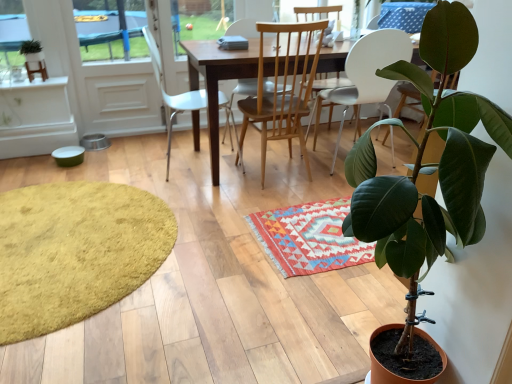
Find the location of a particular element. This screenshot has width=512, height=384. space that is in front of multicolored woven rug at center, which appears as the 1th mat when viewed from the right is located at coordinates (307, 306).